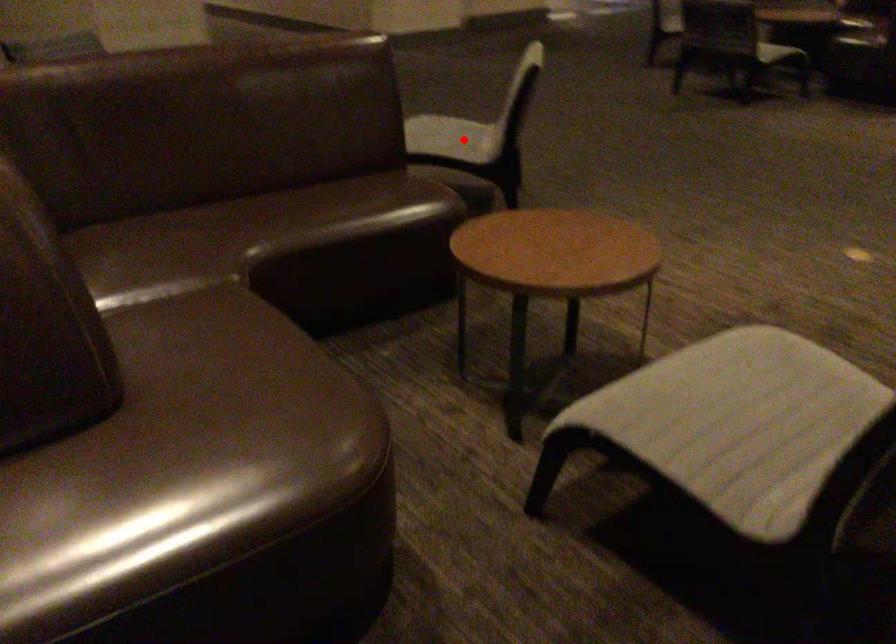
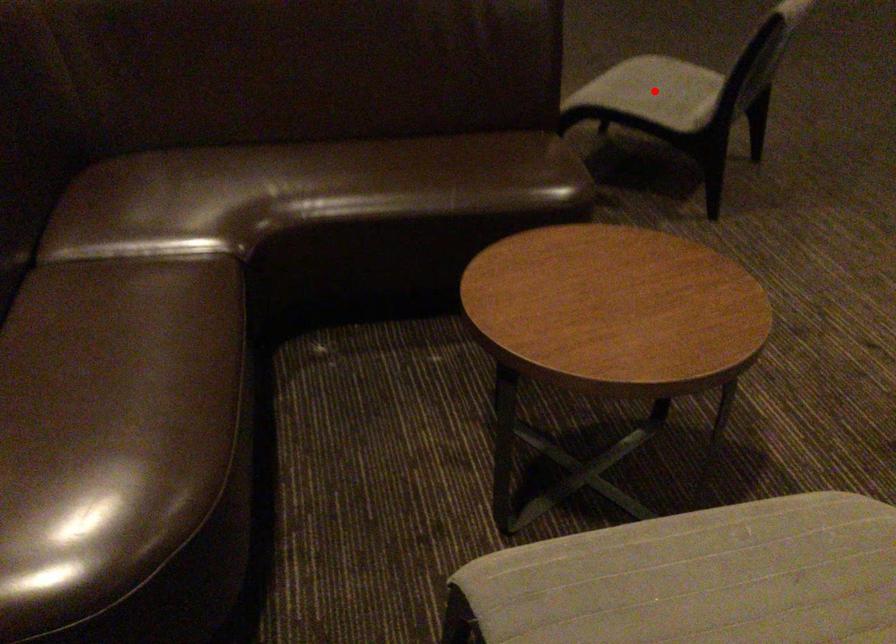
I am providing you with two images of the same scene from different viewpoints. A red point is marked on the first image and another point is marked on the second image. Is the marked point in image1 the same physical position as the marked point in image2?

Yes